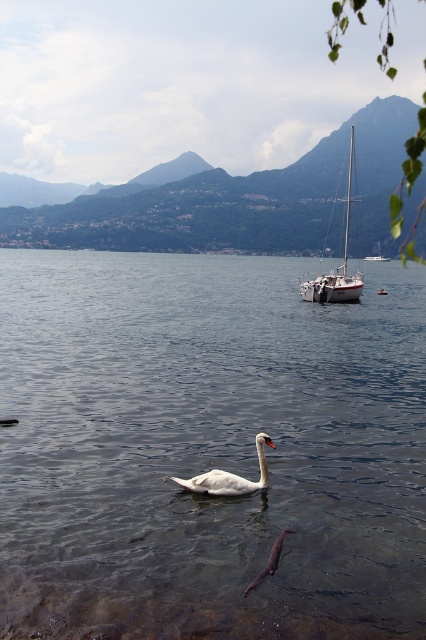
Question: Estimate the real-world distances between objects in this image. Which object is farther from the white glossy sailboat at center?

Choices:
 (A) white glossy sailboat at upper right
 (B) clear water at center

Answer: (B)

Question: Which of these objects is positioned farthest from the clear water at center?

Choices:
 (A) white glossy swan at center
 (B) white glossy sailboat at center

Answer: (B)

Question: Among these objects, which one is nearest to the camera?

Choices:
 (A) white glossy swan at center
 (B) clear water at center
 (C) white glossy sailboat at upper right
 (D) shiny purple fish at lower center

Answer: (B)

Question: Where is white glossy sailboat at upper right located in relation to white glossy sailboat at center in the image?

Choices:
 (A) below
 (B) above

Answer: (B)

Question: Observing the image, what is the correct spatial positioning of clear water at center in reference to white glossy swan at center?

Choices:
 (A) right
 (B) left

Answer: (B)

Question: Does clear water at center have a larger size compared to white glossy sailboat at upper right?

Choices:
 (A) no
 (B) yes

Answer: (A)